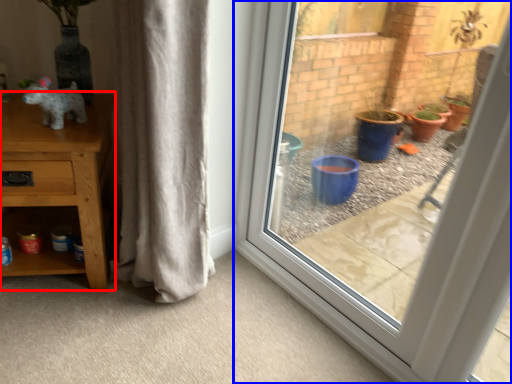
Question: Which object appears closest to the camera in this image, furniture (highlighted by a red box) or window (highlighted by a blue box)?

Choices:
 (A) furniture
 (B) window

Answer: (B)